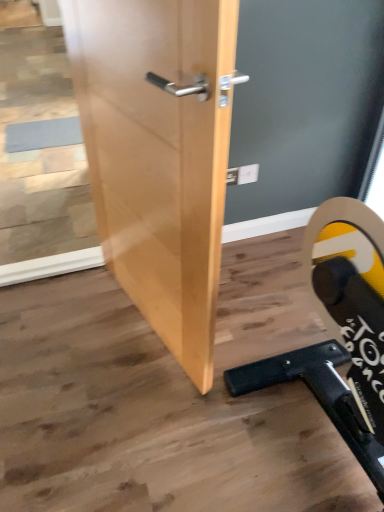
What do you see at coordinates (159, 154) in the screenshot?
I see `natural wood door at center` at bounding box center [159, 154].

This screenshot has width=384, height=512. Find the location of `natural wood door at center`. natural wood door at center is located at coordinates (159, 154).

Image resolution: width=384 pixels, height=512 pixels. I want to click on natural wood door at center, so click(159, 154).